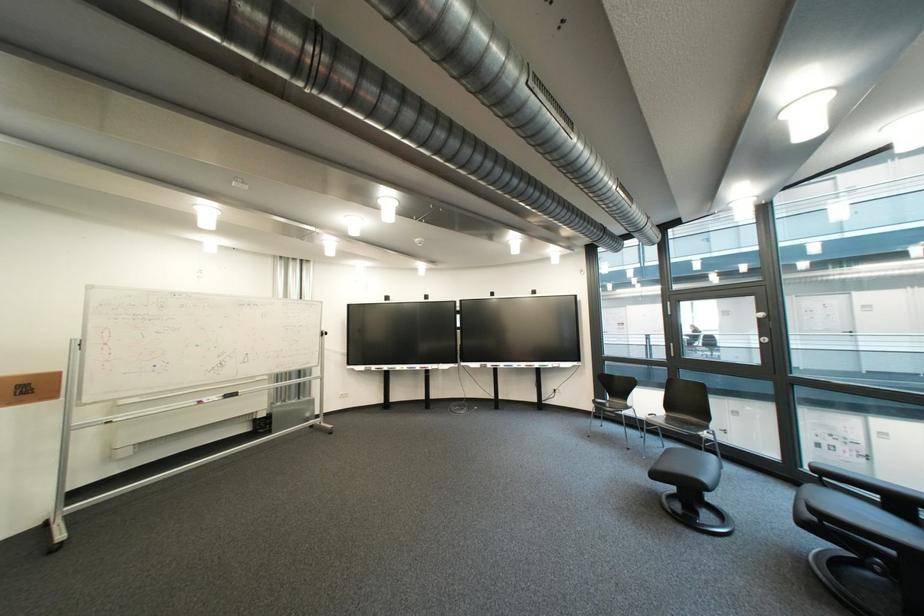
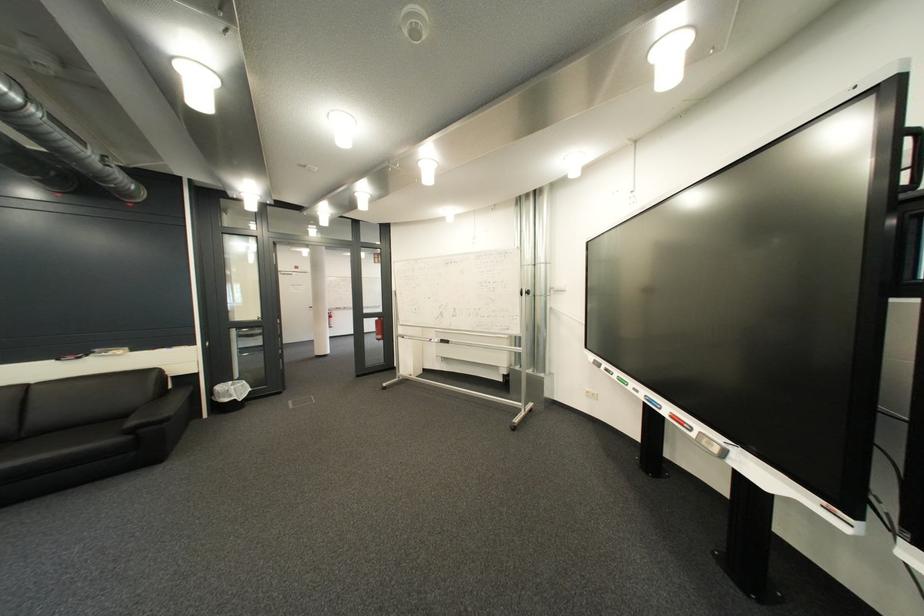
Locate, in the second image, the point that corresponds to the point at 268,382 in the first image.

(509, 338)